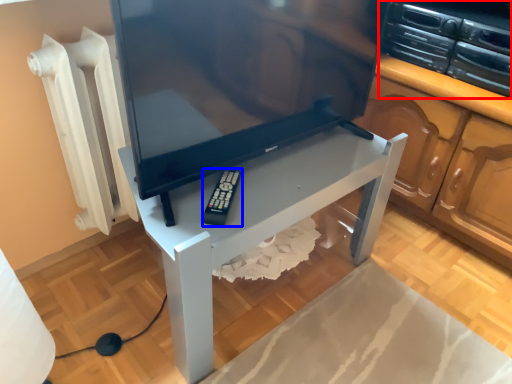
Question: Which of the following is the closest to the observer, appliance (highlighted by a red box) or equipment (highlighted by a blue box)?

Choices:
 (A) appliance
 (B) equipment

Answer: (B)